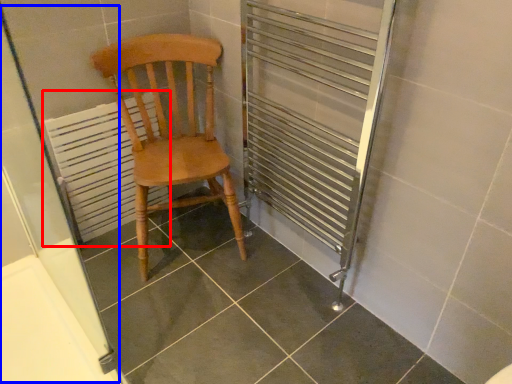
Question: Which object appears closest to the camera in this image, radiator (highlighted by a red box) or screen door (highlighted by a blue box)?

Choices:
 (A) radiator
 (B) screen door

Answer: (B)